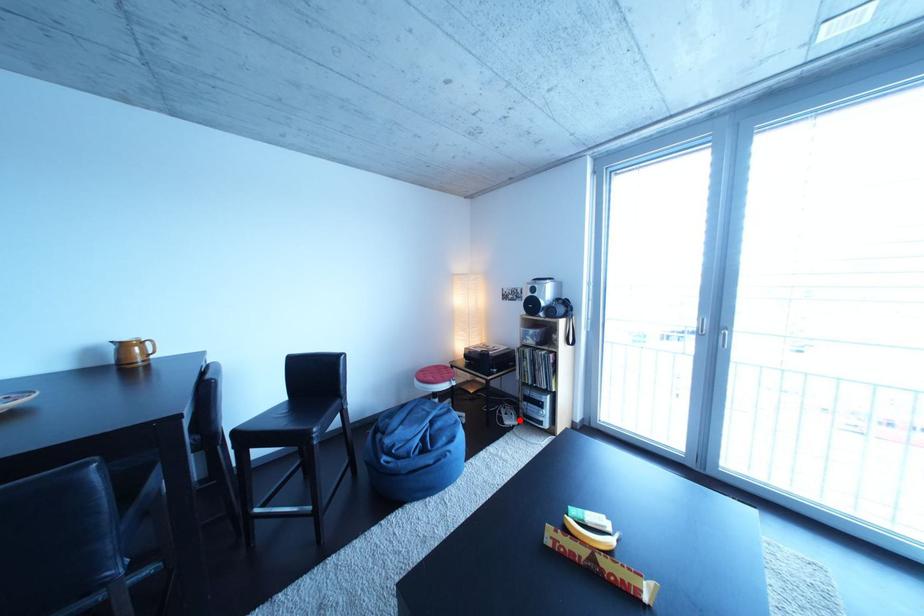
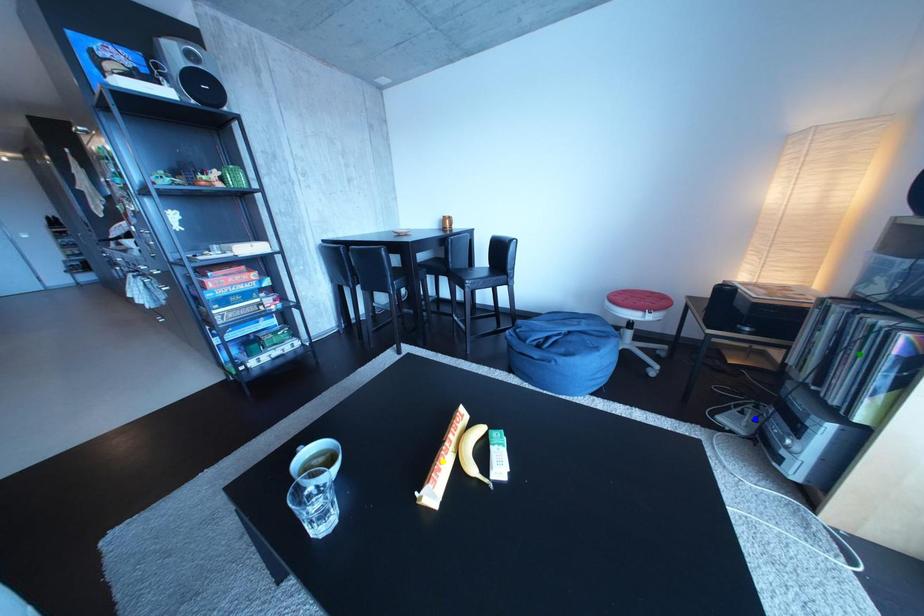
Question: I am providing you with two images of the same scene from different viewpoints. A red point is marked on the first image. You are given multiple points on the second image. In image 2, which mark is for the same physical point as the one in image 1?

Choices:
 (A) yellow point
 (B) green point
 (C) blue point

Answer: (C)